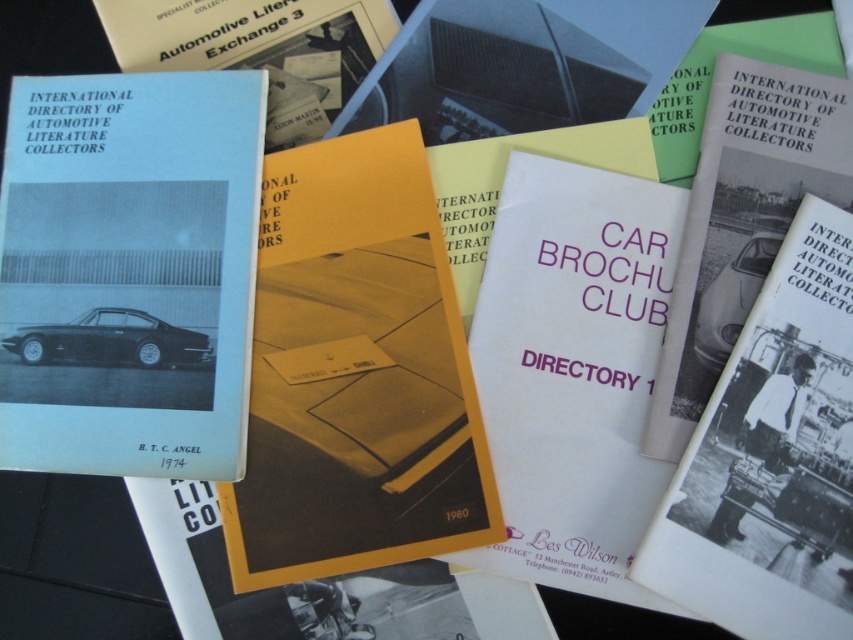
From the picture: Between matte black book at left and white glossy car at center, which one is positioned higher?

Positioned higher is matte black book at left.

Between matte black book at left and white glossy car at center, which one has more height?

matte black book at left

This screenshot has height=640, width=853. I want to click on matte black book at left, so click(128, 273).

Can you confirm if yellow paper brochure at center is positioned below white paper directory at center?

Actually, yellow paper brochure at center is above white paper directory at center.

Which is behind, point (383, 502) or point (788, 500)?

Point (383, 502)

This screenshot has width=853, height=640. Find the location of `yellow paper brochure at center`. yellow paper brochure at center is located at coordinates (355, 372).

Based on the photo, who is lower down, matte blue booklet at upper left or white glossy car at center?

Positioned lower is white glossy car at center.

In the scene shown: Is matte blue booklet at upper left positioned at the back of white glossy car at center?

Yes, matte blue booklet at upper left is behind white glossy car at center.

Is point (172, 54) farther from camera compared to point (721, 355)?

Yes.

Identify the location of matte blue booklet at upper left. (260, 49).